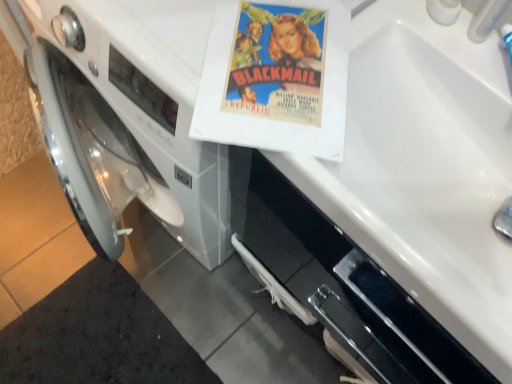
At what (x,y) coordinates should I click in order to perform the action: click on free point above matte paper poster at center (from a real-world perspective). Please return your answer as a coordinate pair (x, y). This screenshot has height=384, width=512. Looking at the image, I should click on (280, 62).